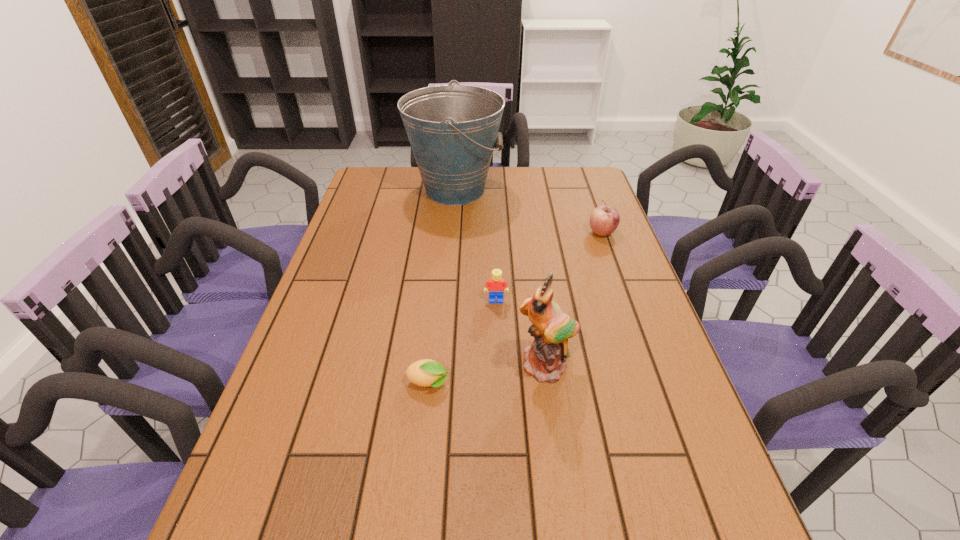
This screenshot has height=540, width=960. I want to click on vacant space located 0.200m on the face of the Lego, so click(x=498, y=363).

The width and height of the screenshot is (960, 540). Find the location of `vacant area situated 0.280m with leaves positioned above the lemon`. vacant area situated 0.280m with leaves positioned above the lemon is located at coordinates (573, 383).

The image size is (960, 540). In order to click on object positioned at the far edge in this screenshot , I will do `click(453, 129)`.

What are the coordinates of `object located at the right edge` in the screenshot? It's located at (604, 220).

At what (x,y) coordinates should I click in order to perform the action: click on vacant point at the far edge. Please return your answer as a coordinate pair (x, y). The image size is (960, 540). Looking at the image, I should click on (489, 180).

The height and width of the screenshot is (540, 960). What are the coordinates of `free location at the left edge` in the screenshot? It's located at (336, 338).

Identify the location of free space at the right edge. (x=632, y=343).

Identify the location of free space at the far left corner. (391, 174).

In the image, there is a desktop. At what (x,y) coordinates should I click in order to perform the action: click on blank space at the far right corner. Please return your answer as a coordinate pair (x, y). Looking at the image, I should click on (567, 173).

Locate an element on the screen. Image resolution: width=960 pixels, height=540 pixels. vacant area that lies between the parrot and the third nearest object is located at coordinates (521, 333).